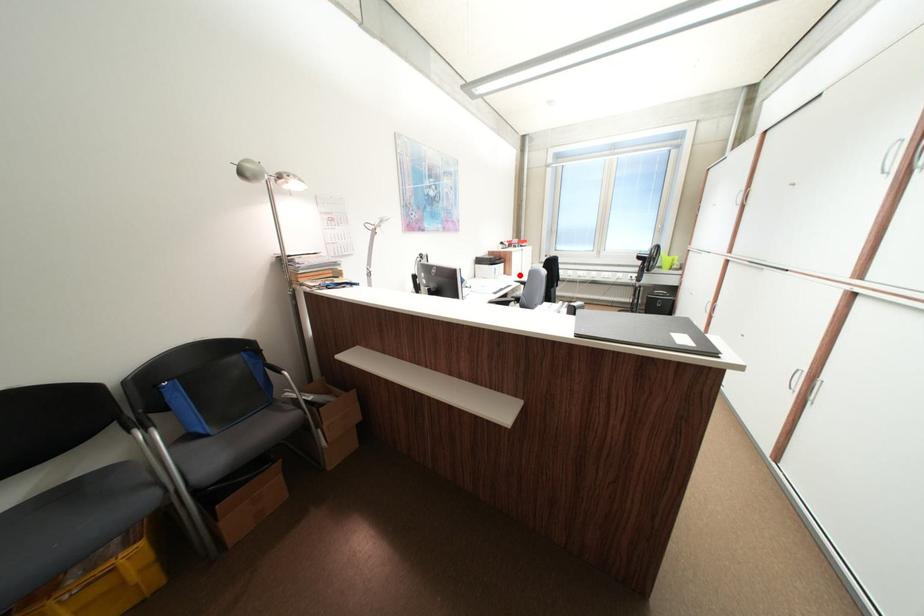
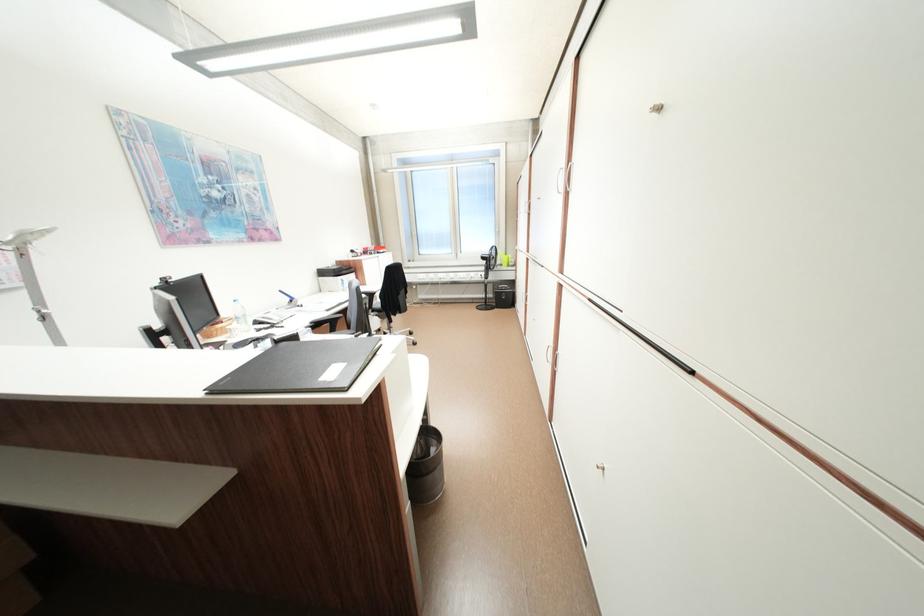
Question: I am providing you with two images of the same scene from different viewpoints. A red point is marked on the first image. At the location where the point appears in image 1, is it still visible in image 2?

Choices:
 (A) Yes
 (B) No

Answer: (A)